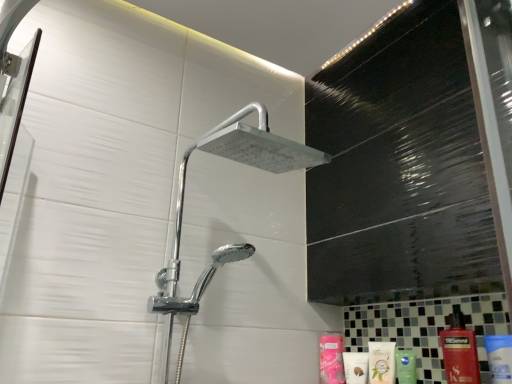
Question: From the image's perspective, is white matte lotion at lower right, placed as the second toiletry when sorted from back to front, above white glossy mouthwash at lower right?

Choices:
 (A) no
 (B) yes

Answer: (A)

Question: From a real-world perspective, is white matte lotion at lower right, placed as the second toiletry when sorted from back to front, on top of white glossy mouthwash at lower right?

Choices:
 (A) no
 (B) yes

Answer: (A)

Question: From the image's perspective, is white matte lotion at lower right, the 1th toiletry when ordered from front to back, under white glossy mouthwash at lower right?

Choices:
 (A) yes
 (B) no

Answer: (A)

Question: Could you tell me if white matte lotion at lower right, placed as the second toiletry when sorted from back to front, is turned towards white glossy mouthwash at lower right?

Choices:
 (A) no
 (B) yes

Answer: (A)

Question: Considering the relative sizes of white matte lotion at lower right, the 1th toiletry when ordered from front to back, and white glossy mouthwash at lower right in the image provided, is white matte lotion at lower right, the 1th toiletry when ordered from front to back, smaller than white glossy mouthwash at lower right?

Choices:
 (A) no
 (B) yes

Answer: (B)

Question: Is white matte lotion at lower right, placed as the second toiletry when sorted from back to front, facing away from white glossy mouthwash at lower right?

Choices:
 (A) no
 (B) yes

Answer: (A)

Question: From the image's perspective, does pink matte lotion at lower center, the first toiletry in the back-to-front sequence, appear lower than red glossy shampoo at lower right?

Choices:
 (A) no
 (B) yes

Answer: (B)

Question: Does pink matte lotion at lower center, the second toiletry in the front-to-back sequence, appear on the left side of red glossy shampoo at lower right?

Choices:
 (A) no
 (B) yes

Answer: (B)

Question: Considering the relative positions of pink matte lotion at lower center, the second toiletry in the front-to-back sequence, and red glossy shampoo at lower right in the image provided, is pink matte lotion at lower center, the second toiletry in the front-to-back sequence, behind red glossy shampoo at lower right?

Choices:
 (A) yes
 (B) no

Answer: (A)

Question: Is pink matte lotion at lower center, the second toiletry in the front-to-back sequence, wider than red glossy shampoo at lower right?

Choices:
 (A) yes
 (B) no

Answer: (B)

Question: Can we say pink matte lotion at lower center, the first toiletry in the back-to-front sequence, lies outside red glossy shampoo at lower right?

Choices:
 (A) no
 (B) yes

Answer: (B)

Question: Is pink matte lotion at lower center, the second toiletry in the front-to-back sequence, facing towards red glossy shampoo at lower right?

Choices:
 (A) yes
 (B) no

Answer: (B)

Question: Is white glossy mouthwash at lower right positioned before pink matte lotion at lower center, the second toiletry in the front-to-back sequence?

Choices:
 (A) yes
 (B) no

Answer: (A)